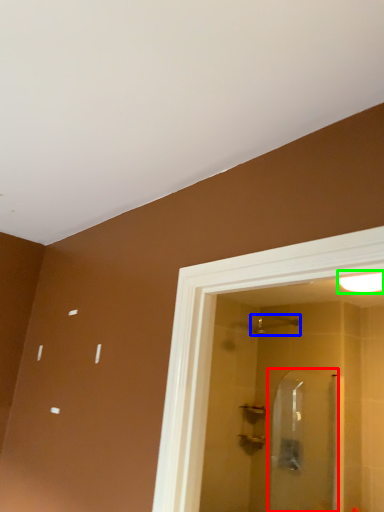
Question: Considering the real-world distances, which object is farthest from screen door (highlighted by a red box)? shower (highlighted by a blue box) or light fixture (highlighted by a green box)?

Choices:
 (A) shower
 (B) light fixture

Answer: (B)